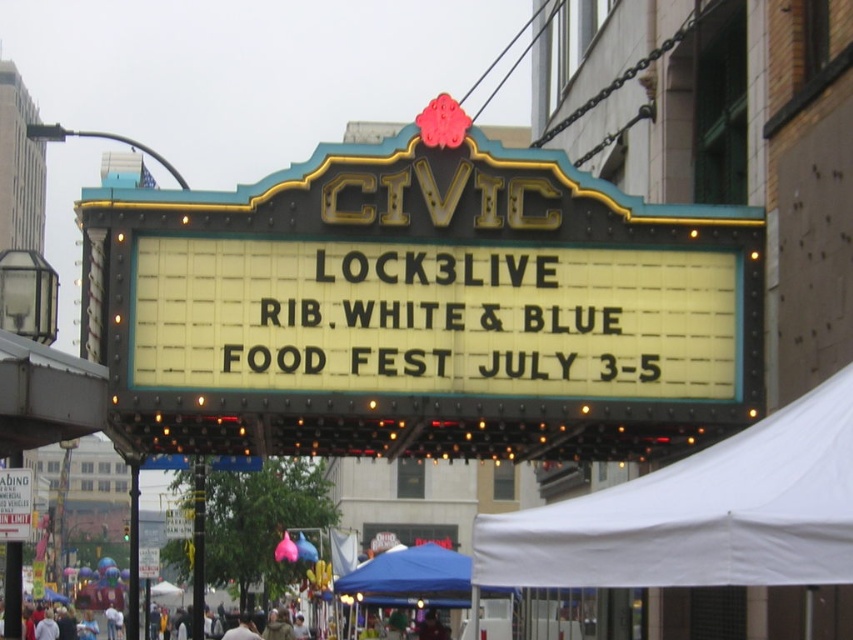
From the picture: Can you confirm if white fabric canopy at lower right is positioned below white matte crowd at lower center?

No, white fabric canopy at lower right is not below white matte crowd at lower center.

Is point (602, 541) closer to viewer compared to point (241, 636)?

That is True.

Find the location of a particular element. Image resolution: width=853 pixels, height=640 pixels. white fabric canopy at lower right is located at coordinates (699, 513).

Between point (397, 582) and point (28, 496), which one is positioned in front?

Point (28, 496) is in front.

Does blue fabric canopy at lower center have a greater height compared to white paper sign at upper center?

Indeed, blue fabric canopy at lower center has a greater height compared to white paper sign at upper center.

In order to click on blue fabric canopy at lower center in this screenshot , I will do `click(410, 577)`.

Locate an element on the screen. This screenshot has height=640, width=853. blue fabric canopy at lower center is located at coordinates (410, 577).

Between gold metallic marquee at center and blue fabric canopy at lower center, which one is positioned higher?

gold metallic marquee at center is higher up.

Between point (373, 244) and point (437, 589), which one is positioned in front?

Point (373, 244)

At what (x,y) coordinates should I click in order to perform the action: click on gold metallic marquee at center. Please return your answer as a coordinate pair (x, y). Looking at the image, I should click on (422, 308).